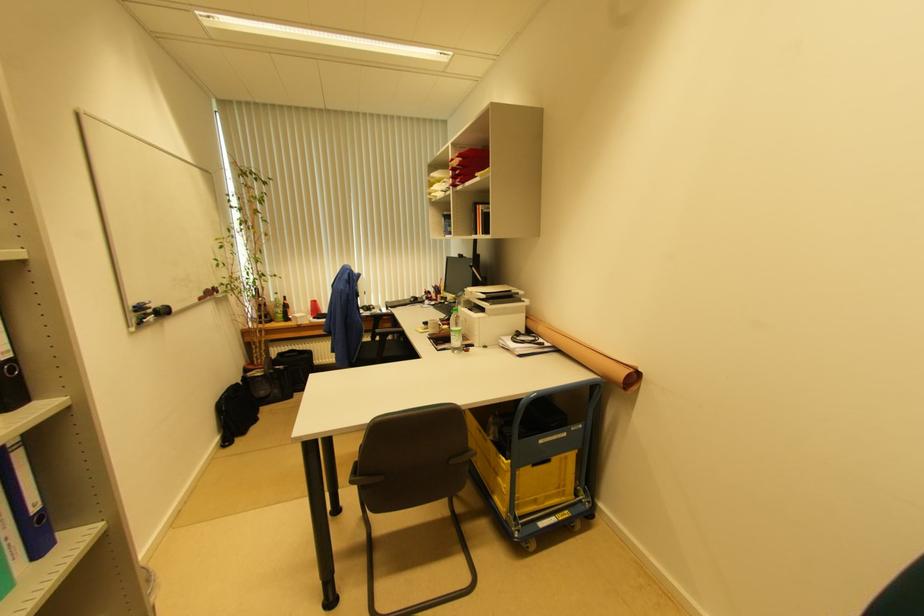
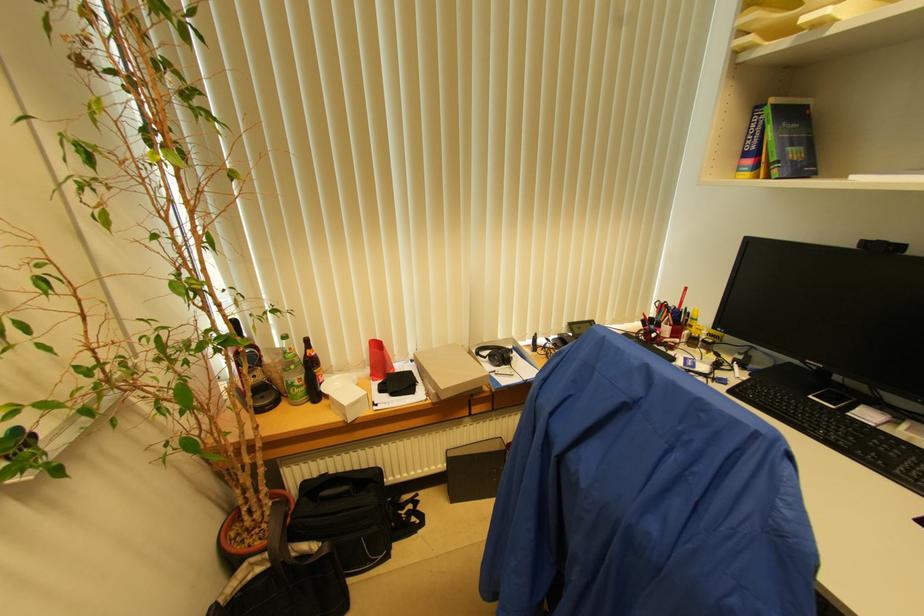
Where in the second image is the point corresponding to the point at 265,374 from the first image?

(273, 561)